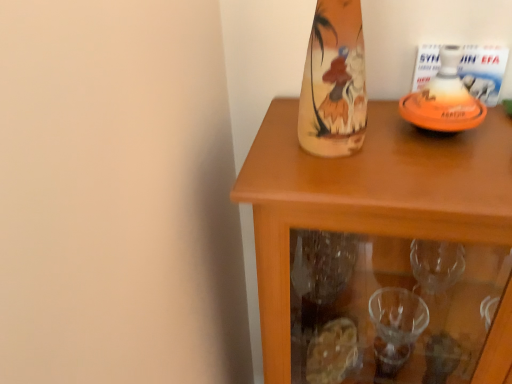
I want to click on orange matte bottle at upper right, so click(x=444, y=99).

What is the approximate height of orange matte bottle at upper right?

orange matte bottle at upper right is 4.92 inches in height.

The width and height of the screenshot is (512, 384). Describe the element at coordinates (444, 99) in the screenshot. I see `orange matte bottle at upper right` at that location.

Image resolution: width=512 pixels, height=384 pixels. Describe the element at coordinates (367, 198) in the screenshot. I see `wooden cabinet at upper right` at that location.

Identify the location of wooden cabinet at upper right. This screenshot has height=384, width=512. (367, 198).

Where is `orange matte bottle at upper right`? orange matte bottle at upper right is located at coordinates (444, 99).

Considering the relative positions of wooden cabinet at upper right and orange matte bottle at upper right in the image provided, is wooden cabinet at upper right to the right of orange matte bottle at upper right from the viewer's perspective?

Yes.

Consider the image. Between wooden cabinet at upper right and orange matte bottle at upper right, which one is positioned behind?

orange matte bottle at upper right is further from the camera.

Which is behind, point (262, 246) or point (403, 98)?

The point (403, 98) is farther.

From the image's perspective, is wooden cabinet at upper right above or below orange matte bottle at upper right?

From the image's perspective, wooden cabinet at upper right appears below orange matte bottle at upper right.

From a real-world perspective, is wooden cabinet at upper right physically below orange matte bottle at upper right?

Yes, from a real-world perspective, wooden cabinet at upper right is under orange matte bottle at upper right.

Does wooden cabinet at upper right have a greater width compared to orange matte bottle at upper right?

Correct, the width of wooden cabinet at upper right exceeds that of orange matte bottle at upper right.

Which of these two, wooden cabinet at upper right or orange matte bottle at upper right, stands shorter?

With less height is orange matte bottle at upper right.

Does wooden cabinet at upper right have a larger size compared to orange matte bottle at upper right?

Yes, wooden cabinet at upper right is bigger than orange matte bottle at upper right.

Choose the correct answer: Is wooden cabinet at upper right inside orange matte bottle at upper right or outside it?

wooden cabinet at upper right lies outside orange matte bottle at upper right.

Are wooden cabinet at upper right and orange matte bottle at upper right far apart?

No, there isn't a large distance between wooden cabinet at upper right and orange matte bottle at upper right.

Is wooden cabinet at upper right facing towards orange matte bottle at upper right?

No, wooden cabinet at upper right is not turned towards orange matte bottle at upper right.

Measure the distance from wooden cabinet at upper right to orange matte bottle at upper right.

wooden cabinet at upper right is 6.83 inches from orange matte bottle at upper right.

Locate an element on the screen. The width and height of the screenshot is (512, 384). bottle behind the wooden cabinet at upper right is located at coordinates (444, 99).

Which is more to the left, orange matte bottle at upper right or wooden cabinet at upper right?

From the viewer's perspective, orange matte bottle at upper right appears more on the left side.

Which object is closer to the camera, orange matte bottle at upper right or wooden cabinet at upper right?

wooden cabinet at upper right is more forward.

Between point (465, 113) and point (265, 225), which one is positioned behind?

Positioned behind is point (465, 113).

From the image's perspective, which object appears higher, orange matte bottle at upper right or wooden cabinet at upper right?

orange matte bottle at upper right.

From a real-world perspective, is orange matte bottle at upper right physically located above or below wooden cabinet at upper right?

Clearly, from a real-world perspective, orange matte bottle at upper right is above wooden cabinet at upper right.

Is orange matte bottle at upper right wider than wooden cabinet at upper right?

No.

Is orange matte bottle at upper right taller than wooden cabinet at upper right?

Incorrect, the height of orange matte bottle at upper right is not larger of that of wooden cabinet at upper right.

Does orange matte bottle at upper right have a larger size compared to wooden cabinet at upper right?

No.

Do you think orange matte bottle at upper right is within wooden cabinet at upper right, or outside of it?

orange matte bottle at upper right is not enclosed by wooden cabinet at upper right.

Is orange matte bottle at upper right with wooden cabinet at upper right?

No, orange matte bottle at upper right is not with wooden cabinet at upper right.

Could you tell me if orange matte bottle at upper right is turned towards wooden cabinet at upper right?

No, orange matte bottle at upper right is not aimed at wooden cabinet at upper right.

You are a GUI agent. You are given a task and a screenshot of the screen. Output one action in this format:
    pyautogui.click(x=<x>, y=<y>)
    Task: Click on the table lying on the right of orange matte bottle at upper right
    
    Given the screenshot: What is the action you would take?
    pyautogui.click(x=367, y=198)

Locate an element on the screen. The height and width of the screenshot is (384, 512). table that is in front of the orange matte bottle at upper right is located at coordinates (367, 198).

Identify the location of bottle that is above the wooden cabinet at upper right (from the image's perspective). (444, 99).